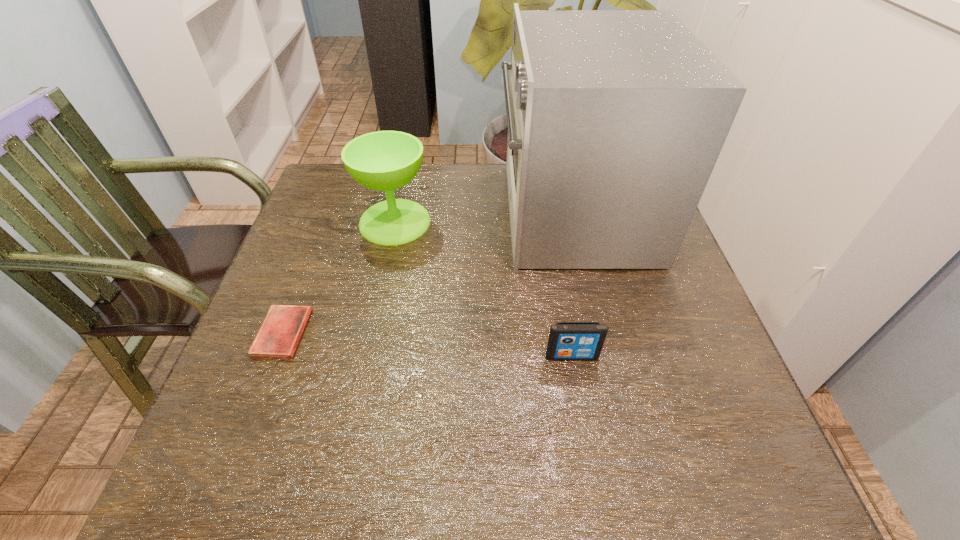
At what (x,y) coordinates should I click in order to perform the action: click on free space located on the front screen of the iPod. Please return your answer as a coordinate pair (x, y). The height and width of the screenshot is (540, 960). Looking at the image, I should click on (578, 395).

I want to click on vacant space situated 0.190m on the front of the leftmost object, so click(x=233, y=461).

Where is `toaster oven at the far edge`? The image size is (960, 540). toaster oven at the far edge is located at coordinates (616, 118).

Locate an element on the screen. The image size is (960, 540). wineglass situated at the far edge is located at coordinates (385, 161).

Identify the location of wineglass that is at the left edge. 385,161.

Locate an element on the screen. diary located in the left edge section of the desktop is located at coordinates (280, 332).

You are a GUI agent. You are given a task and a screenshot of the screen. Output one action in this format:
    pyautogui.click(x=<x>, y=<y>)
    Task: Click on the object located in the right edge section of the desktop
    The image size is (960, 540).
    Given the screenshot: What is the action you would take?
    pyautogui.click(x=616, y=118)

Image resolution: width=960 pixels, height=540 pixels. Find the location of `object at the far left corner`. object at the far left corner is located at coordinates (385, 161).

Find the location of a particular element. The image size is (960, 540). object that is at the far right corner is located at coordinates (616, 118).

Where is `free region at the far edge of the desktop`? free region at the far edge of the desktop is located at coordinates (483, 174).